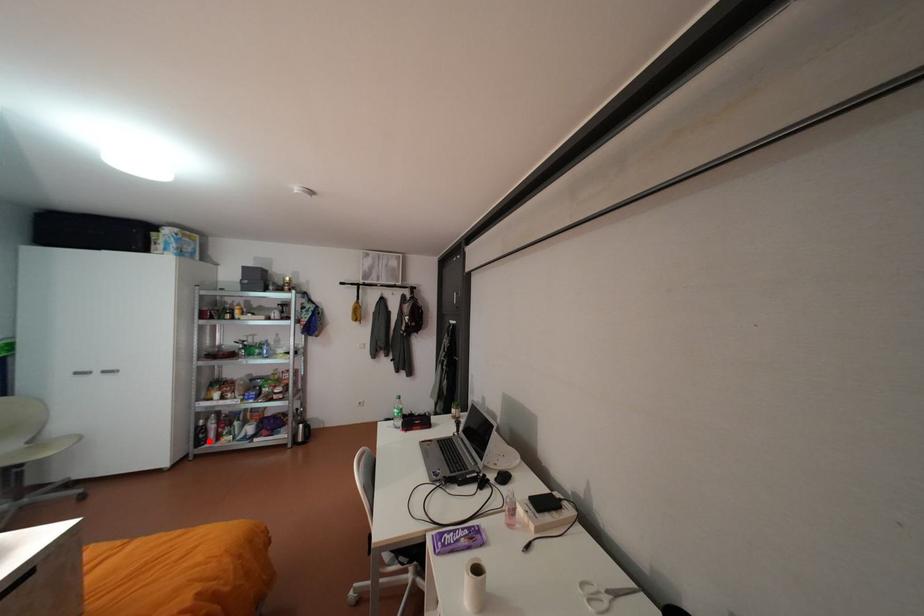
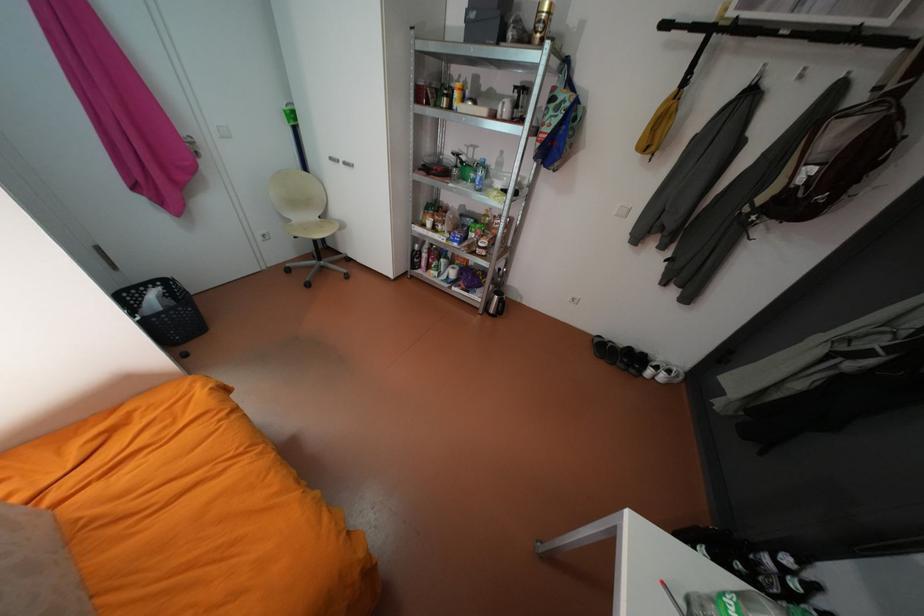
Find the pixel in the second image that matches the highlighted location in the first image.

(423, 265)